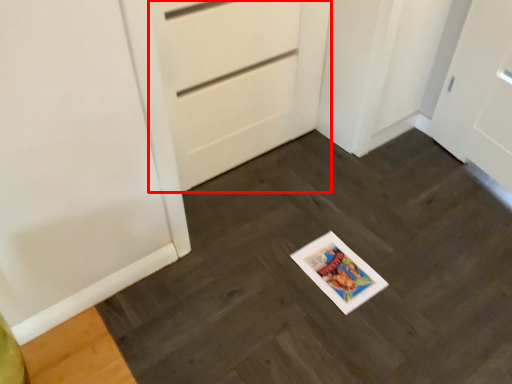
Question: From the image, what is the correct spatial relationship of door (annotated by the red box) in relation to slate?

Choices:
 (A) left
 (B) right

Answer: (A)